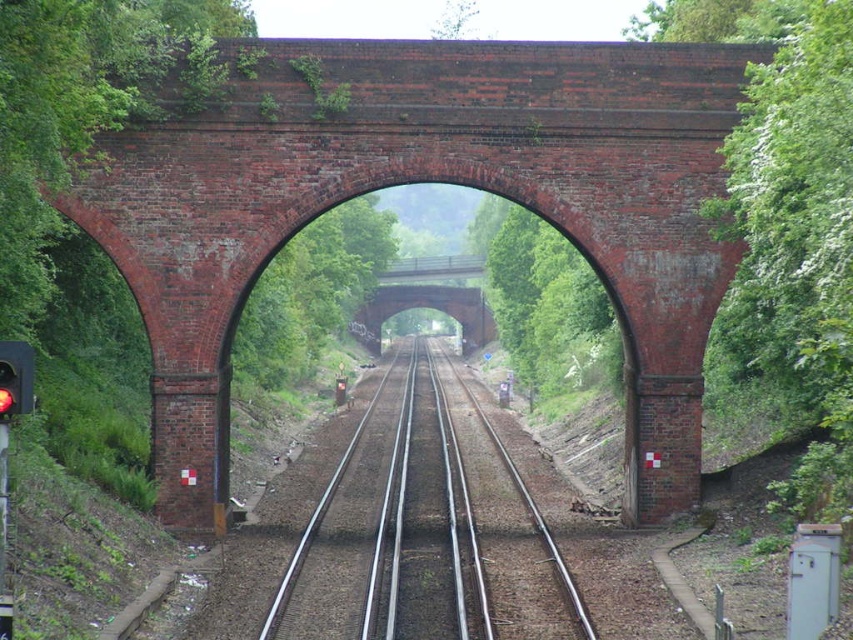
You are a photographer planning to capture the brick arch bridge at center and the red glass traffic light at left in a single frame. Based on their sizes, which object should you position closer to the camera to ensure both are clearly visible in the photo?

The brick arch bridge at center is bigger than the red glass traffic light at left. To ensure both are clearly visible, position the brick arch bridge at center closer to the camera so its larger size is balanced with the smaller red glass traffic light at left.

You are a railway engineer assessing the scene. You need to determine the spatial relationship between the metallic smooth train track at center and the red glass traffic light at left. Which object is positioned lower in the image?

The metallic smooth train track at center is positioned lower than the red glass traffic light at left.

You are standing near the railway tracks and want to cross the brick arch bridge at center. Considering the bridge is 302.33 feet away from you, can you walk to it in 5 minutes if your walking speed is 3 miles per hour?

The brick arch bridge at center is 302.33 feet away. At a walking speed of 3 mph, you can cover 302.33 feet in approximately 1 minute and 12 seconds, so yes, you can reach it in 5 minutes.